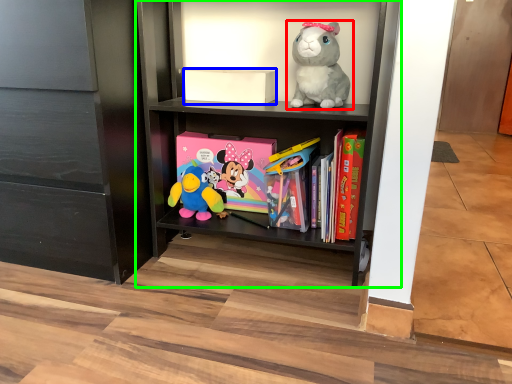
Question: Which is farther away from toy (highlighted by a red box)? box (highlighted by a blue box) or shelf (highlighted by a green box)?

Choices:
 (A) box
 (B) shelf

Answer: (B)